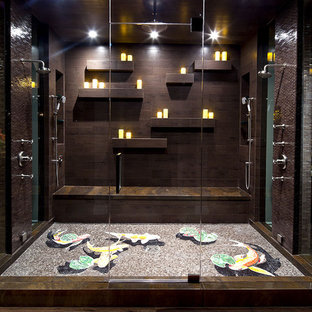
Where is `glass`? The height and width of the screenshot is (312, 312). glass is located at coordinates (175, 179), (72, 164), (232, 164).